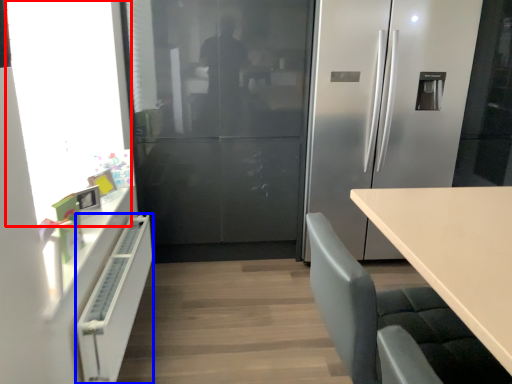
Question: Which object is further to the camera taking this photo, window screen (highlighted by a red box) or cabinetry (highlighted by a blue box)?

Choices:
 (A) window screen
 (B) cabinetry

Answer: (B)